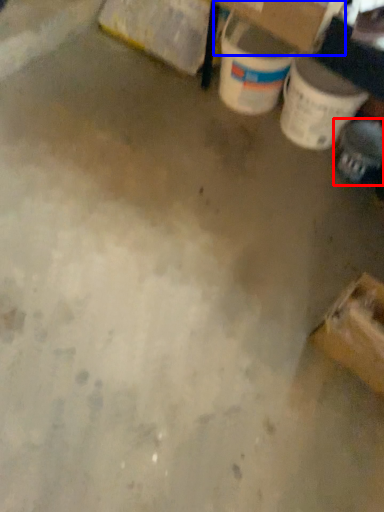
Question: Which point is closer to the camera, footwear (highlighted by a red box) or cardboard box (highlighted by a blue box)?

Choices:
 (A) footwear
 (B) cardboard box

Answer: (B)